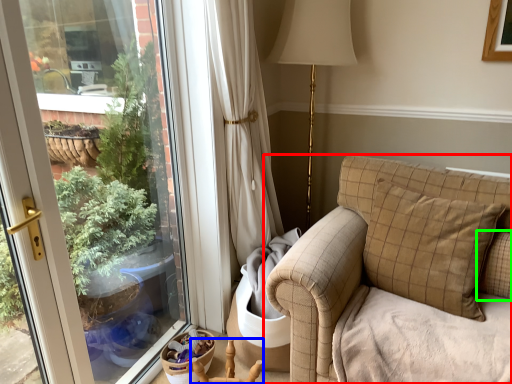
Question: Which is farther away from studio couch (highlighted by a red box)? armchair (highlighted by a blue box) or pillow (highlighted by a green box)?

Choices:
 (A) armchair
 (B) pillow

Answer: (A)